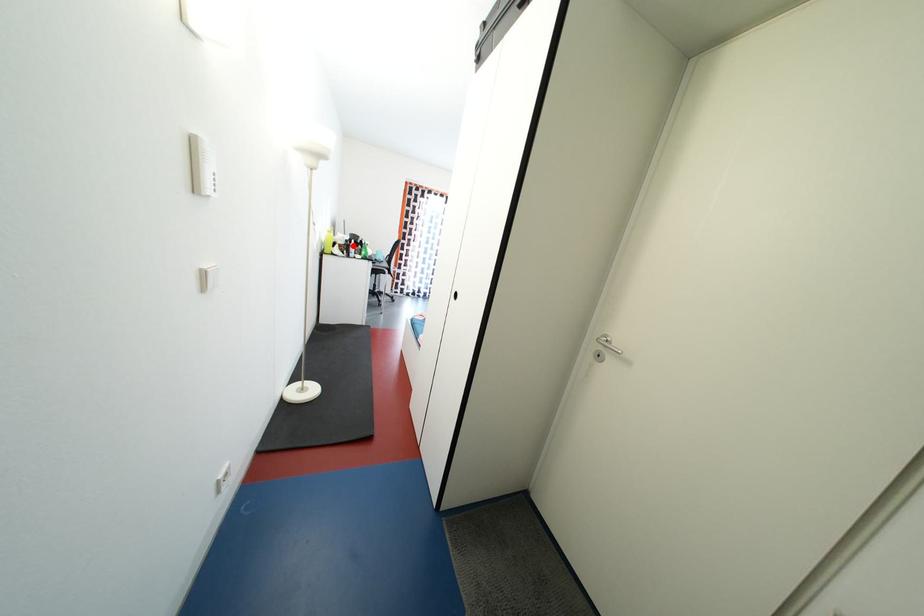
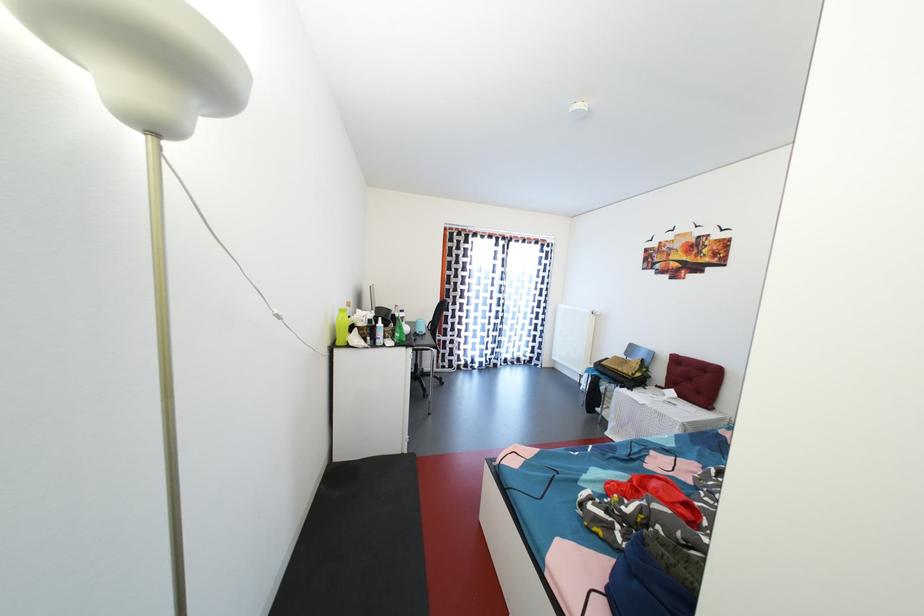
In the second image, find the point that corresponds to the highlighted location in the first image.

(377, 326)